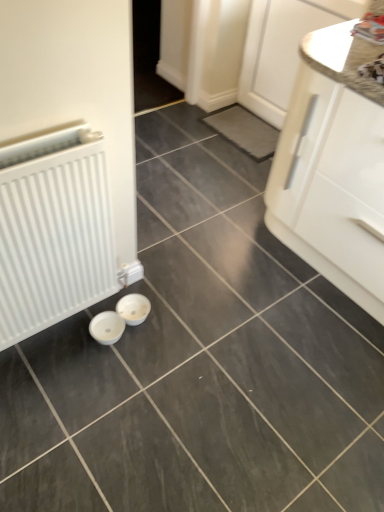
At what (x,y) coordinates should I click in order to perform the action: click on free space in front of white matte radiator at left. Please return your answer as a coordinate pair (x, y). This screenshot has width=384, height=512. Looking at the image, I should click on (71, 400).